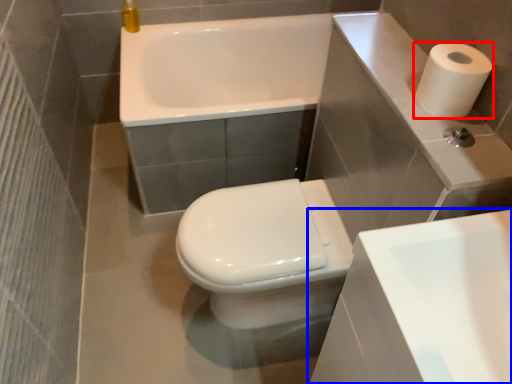
Question: Which of the following is the closest to the observer, paper towel (highlighted by a red box) or sink (highlighted by a blue box)?

Choices:
 (A) paper towel
 (B) sink

Answer: (B)